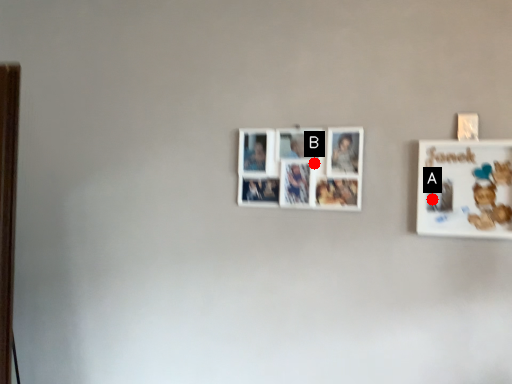
Question: Two points are circled on the image, labeled by A and B beside each circle. Which point is further to the camera?

Choices:
 (A) A is further
 (B) B is further

Answer: (B)